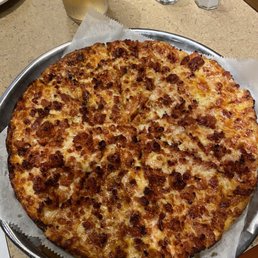
Find the location of a particular element. The image size is (258, 258). glass is located at coordinates (71, 12).